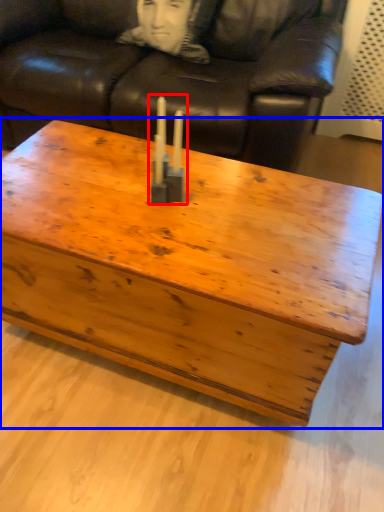
Question: Which point is further to the camera, candle holder (highlighted by a red box) or coffee table (highlighted by a blue box)?

Choices:
 (A) candle holder
 (B) coffee table

Answer: (A)